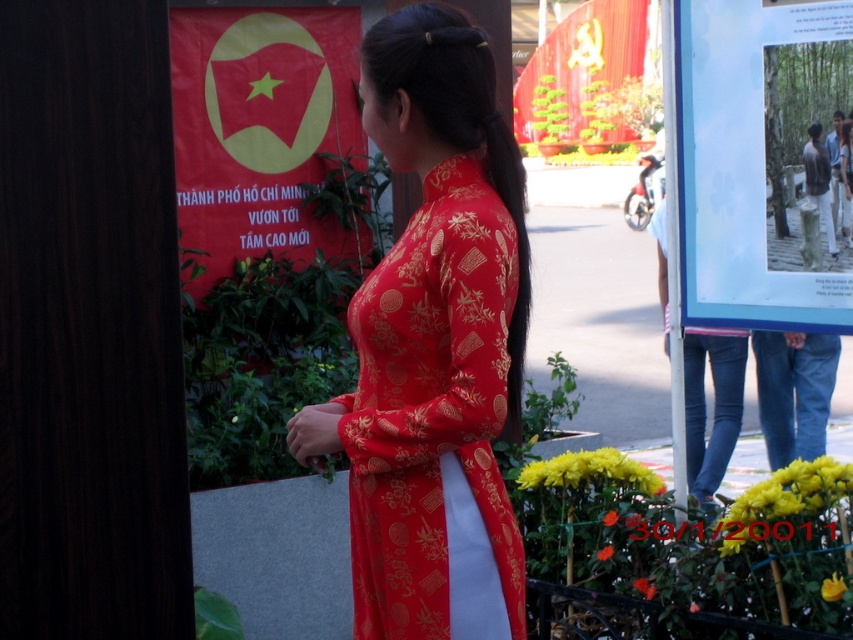
Question: Which object is positioned closest to the silky gold hair at center?

Choices:
 (A) shiny brocade ao dai at center
 (B) red matte poster at upper left
 (C) jeans at lower right
 (D) wooden signboard at upper right

Answer: (A)

Question: Can you confirm if jeans at lower right is smaller than silky gold hair at center?

Choices:
 (A) no
 (B) yes

Answer: (A)

Question: Estimate the real-world distances between objects in this image. Which object is farther from the red matte poster at upper left?

Choices:
 (A) wooden signboard at upper right
 (B) jeans at lower right
 (C) shiny brocade ao dai at center
 (D) silky gold hair at center

Answer: (D)

Question: Does red matte poster at upper left appear over silky gold hair at center?

Choices:
 (A) no
 (B) yes

Answer: (B)

Question: Which point appears farthest from the camera in this image?

Choices:
 (A) (694, 179)
 (B) (724, 348)

Answer: (B)

Question: Does red matte poster at upper left have a lesser width compared to wooden signboard at upper right?

Choices:
 (A) yes
 (B) no

Answer: (B)